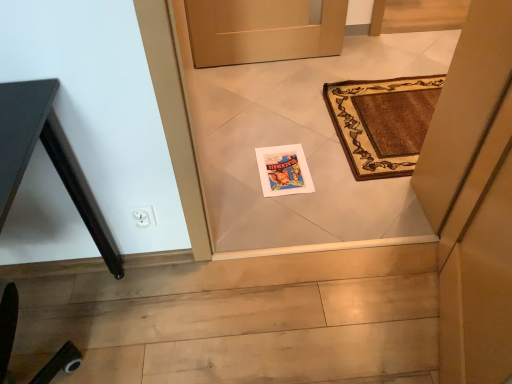
Question: Should I look upward or downward to see matte paper postcard at center?

Choices:
 (A) down
 (B) up

Answer: (B)

Question: Is matte paper postcard at center wider than black matte table at left?

Choices:
 (A) no
 (B) yes

Answer: (A)

Question: From a real-world perspective, is matte paper postcard at center physically below black matte table at left?

Choices:
 (A) no
 (B) yes

Answer: (B)

Question: Can you confirm if matte paper postcard at center is thinner than black matte table at left?

Choices:
 (A) yes
 (B) no

Answer: (A)

Question: Can you confirm if matte paper postcard at center is taller than black matte table at left?

Choices:
 (A) yes
 (B) no

Answer: (B)

Question: Does matte paper postcard at center appear on the right side of black matte table at left?

Choices:
 (A) yes
 (B) no

Answer: (A)

Question: Can you confirm if matte paper postcard at center is smaller than black matte table at left?

Choices:
 (A) no
 (B) yes

Answer: (B)

Question: Considering the relative positions of black matte table at left and matte paper postcard at center in the image provided, is black matte table at left in front of matte paper postcard at center?

Choices:
 (A) yes
 (B) no

Answer: (A)

Question: From the image's perspective, is black matte table at left located above matte paper postcard at center?

Choices:
 (A) yes
 (B) no

Answer: (B)

Question: From a real-world perspective, is black matte table at left below matte paper postcard at center?

Choices:
 (A) yes
 (B) no

Answer: (B)

Question: Is the position of black matte table at left more distant than that of matte paper postcard at center?

Choices:
 (A) no
 (B) yes

Answer: (A)

Question: Is black matte table at left positioned with its back to matte paper postcard at center?

Choices:
 (A) yes
 (B) no

Answer: (B)

Question: Can you confirm if black matte table at left is smaller than matte paper postcard at center?

Choices:
 (A) yes
 (B) no

Answer: (B)

Question: Relative to black matte table at left, is matte paper postcard at center in front or behind?

Choices:
 (A) behind
 (B) front

Answer: (A)